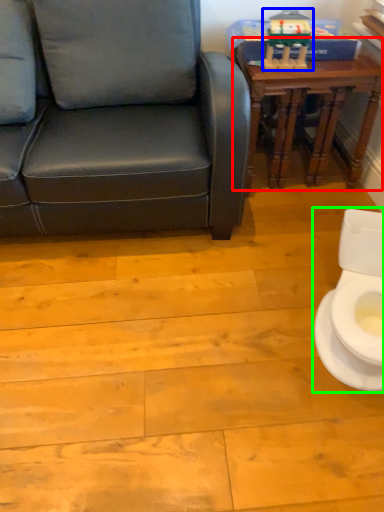
Question: Considering the real-world distances, which object is farthest from table (highlighted by a red box)? toy (highlighted by a blue box) or toilet (highlighted by a green box)?

Choices:
 (A) toy
 (B) toilet

Answer: (B)